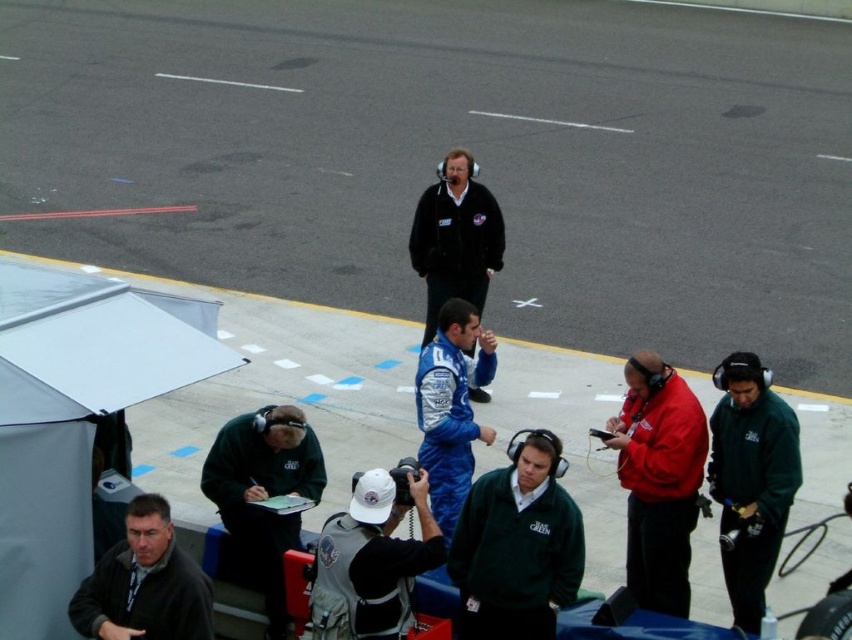
Does asphalt at center appear under dark gray jacket at lower left?

No, asphalt at center is not below dark gray jacket at lower left.

The width and height of the screenshot is (852, 640). I want to click on asphalt at center, so click(x=446, y=148).

This screenshot has width=852, height=640. What do you see at coordinates (446, 148) in the screenshot?
I see `asphalt at center` at bounding box center [446, 148].

Identify the location of asphalt at center. (446, 148).

Between point (671, 516) and point (418, 378), which one is positioned behind?

Positioned behind is point (418, 378).

Who is positioned more to the left, red matte jacket at center or blue fabric suit at center?

blue fabric suit at center is more to the left.

Does point (637, 492) lie in front of point (486, 435)?

Yes.

This screenshot has width=852, height=640. I want to click on red matte jacket at center, so click(x=658, y=480).

What do you see at coordinates (263, 493) in the screenshot?
I see `green fleece jacket at lower left` at bounding box center [263, 493].

Can you confirm if green fleece jacket at lower left is taller than dark gray jacket at lower left?

Indeed, green fleece jacket at lower left has a greater height compared to dark gray jacket at lower left.

Identify the location of green fleece jacket at lower left. The height and width of the screenshot is (640, 852). (263, 493).